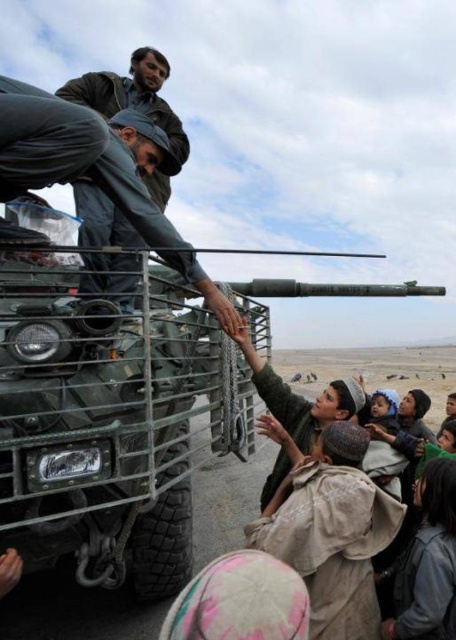
In the scene with the military APC and people in a desert, there are two uniforms visible. The first is a matte green uniform at left, and the second is a dark green uniform at upper left. Which of these two uniforms is larger in size?

The matte green uniform at left is bigger than the dark green uniform at upper left.

You are a military planner trying to position the green matte tank at lower left and the dark green uniform at upper left in a narrow corridor. Given their sizes, which object will require more space horizontally?

The green matte tank at lower left will require more space horizontally because its width is larger than the dark green uniform at upper left.

You are a drone operator controlling a drone that needs to fly from point A to point B. The coordinates for point A are point (164, 372) and point B are point (3, 164). Considering the scene, which point is closer to the drone when it is at the starting position?

Point (3, 164) is closer to the drone at the starting position because it is less further to the viewer than point (164, 372).